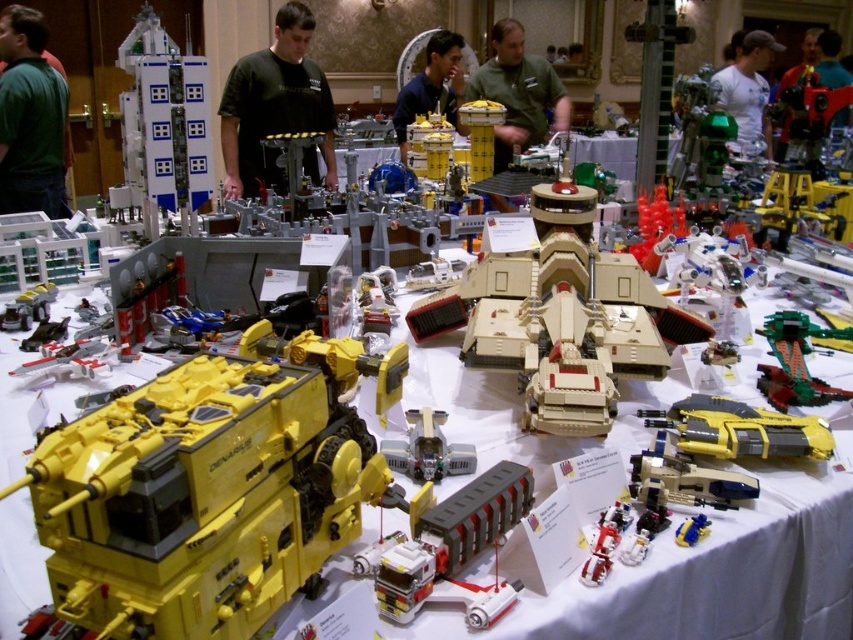
Question: Does black shirt at center have a lesser width compared to yellow plastic gun at center-right?

Choices:
 (A) yes
 (B) no

Answer: (B)

Question: Which object appears farthest from the camera in this image?

Choices:
 (A) black shirt at center
 (B) tan matte tank at center
 (C) white plastic building at upper left
 (D) matte black helmet at upper right

Answer: (D)

Question: Does matte black shirt at center have a larger size compared to white matte shirt at upper right?

Choices:
 (A) yes
 (B) no

Answer: (B)

Question: Which point is closer to the camera?

Choices:
 (A) light gray plastic truck at center
 (B) shiny red plastic robot at center
 (C) brick-like plastic truck at center
 (D) black shirt at center

Answer: (C)

Question: Which point appears farthest from the camera in this image?

Choices:
 (A) (688, 531)
 (B) (827, 76)
 (C) (762, 128)
 (D) (560, 104)

Answer: (B)

Question: Is light gray plastic truck at center below matte black helmet at upper right?

Choices:
 (A) no
 (B) yes

Answer: (B)